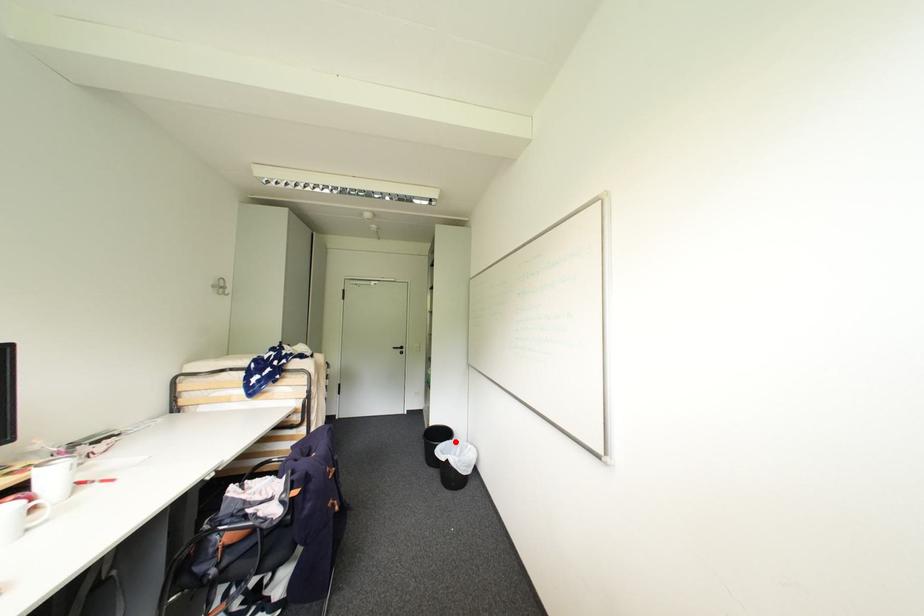
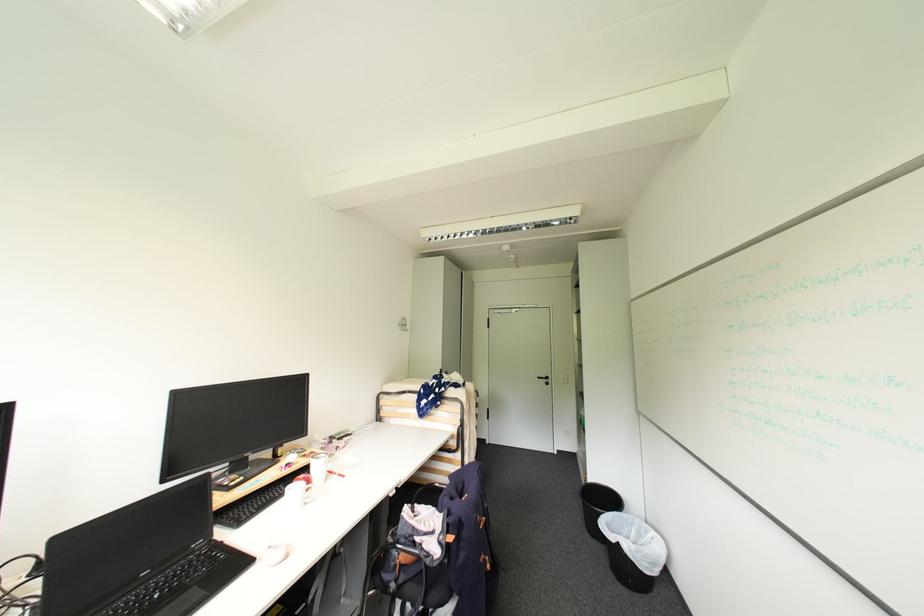
Where in the second image is the point corresponding to the highlighted location from the first image?

(624, 514)